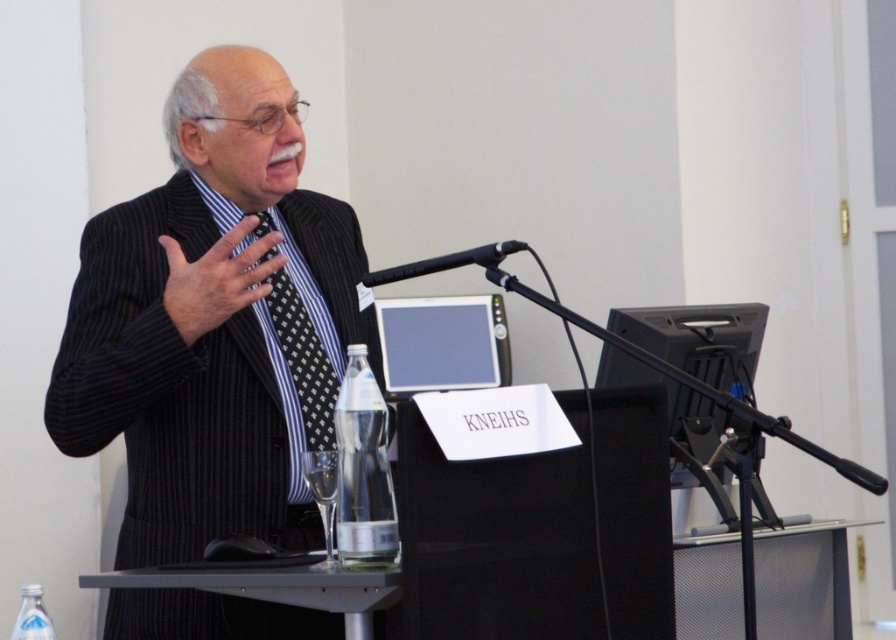
What are the coordinates of `black dotted tie at center` in the screenshot? It's located at (303, 360).

Is black dotted tie at center taller than black matte microphone at center?

Indeed, black dotted tie at center has a greater height compared to black matte microphone at center.

The height and width of the screenshot is (640, 896). What are the coordinates of `black dotted tie at center` in the screenshot? It's located at (303, 360).

I want to click on black dotted tie at center, so click(x=303, y=360).

Is black matte microphone at center thinner than clear plastic bottle at lower left?

No.

Can you confirm if black matte microphone at center is positioned to the right of clear plastic bottle at lower left?

Correct, you'll find black matte microphone at center to the right of clear plastic bottle at lower left.

This screenshot has width=896, height=640. I want to click on black matte microphone at center, so click(446, 262).

Is black dotted tie at center to the left of clear plastic bottle at lower left from the viewer's perspective?

Incorrect, black dotted tie at center is not on the left side of clear plastic bottle at lower left.

Which of these two, black dotted tie at center or clear plastic bottle at lower left, stands taller?

Standing taller between the two is black dotted tie at center.

Who is more forward, (329, 387) or (22, 600)?

Positioned in front is point (22, 600).

Find the location of a particular element. black dotted tie at center is located at coordinates (303, 360).